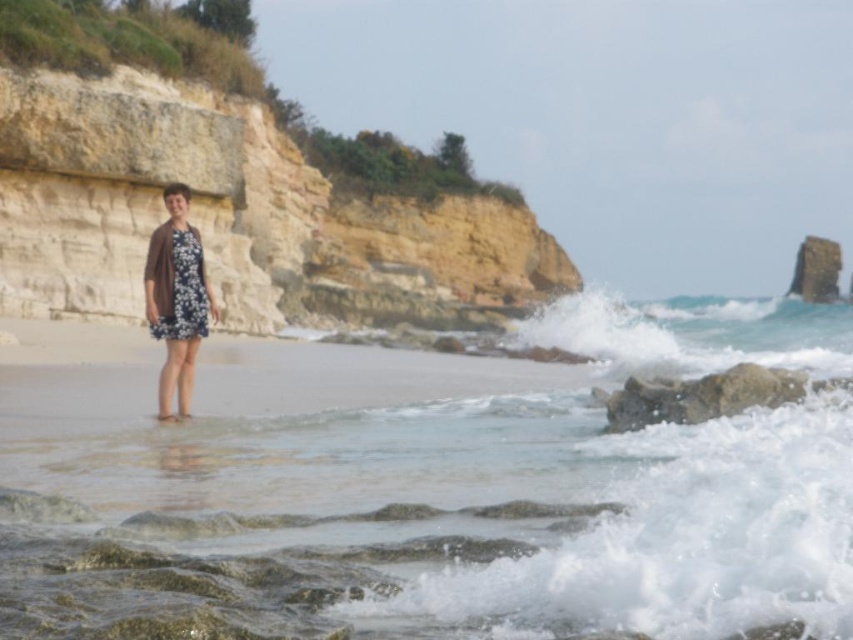
You are a photographer planning to take a picture of the smooth sand cliff at center and the floral dress at center. The camera you have can capture objects within a 60 meter range. Will both objects fit in the same frame?

The smooth sand cliff at center and floral dress at center are 59.40 meters apart from each other, so yes, both objects will fit in the same frame since the distance between them is within the camera range.

You are standing on the beach and want to take a photo of the clear water at lower left. Where exactly should you aim your camera?

You should aim your camera at point (408, 508) to capture the clear water at lower left.

You are a photographer aiming to capture the person in the floral dress at center while ensuring the clear water at lower left is visible in the background. Given their height difference, will the water be fully visible behind the dress?

The clear water at lower left has a lesser height compared to the floral dress at center, so the water will be fully visible behind the dress since it is shorter.